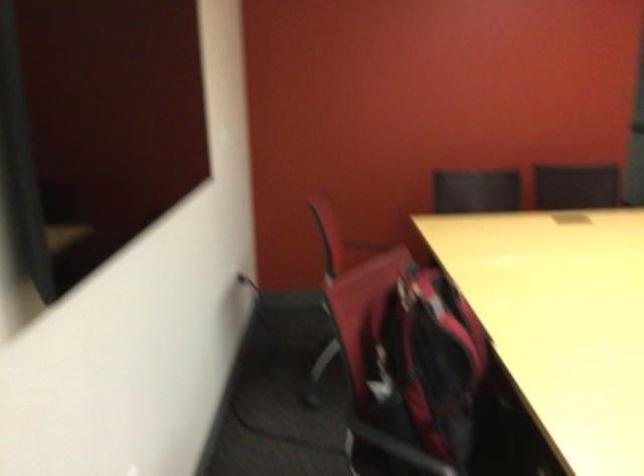
The images are taken continuously from a first-person perspective. In which direction is your viewpoint rotating?

The camera's rotation is toward right-down.